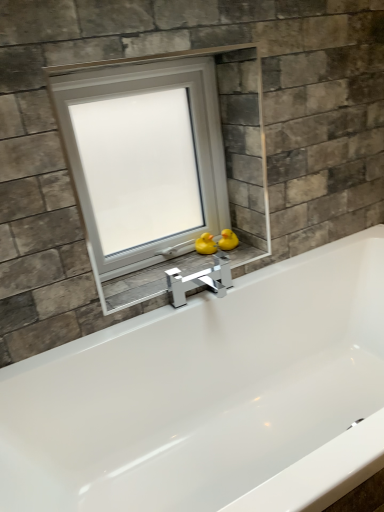
Locate an element on the screen. The width and height of the screenshot is (384, 512). free location above matte gray stone at center (from a real-world perspective) is located at coordinates (185, 268).